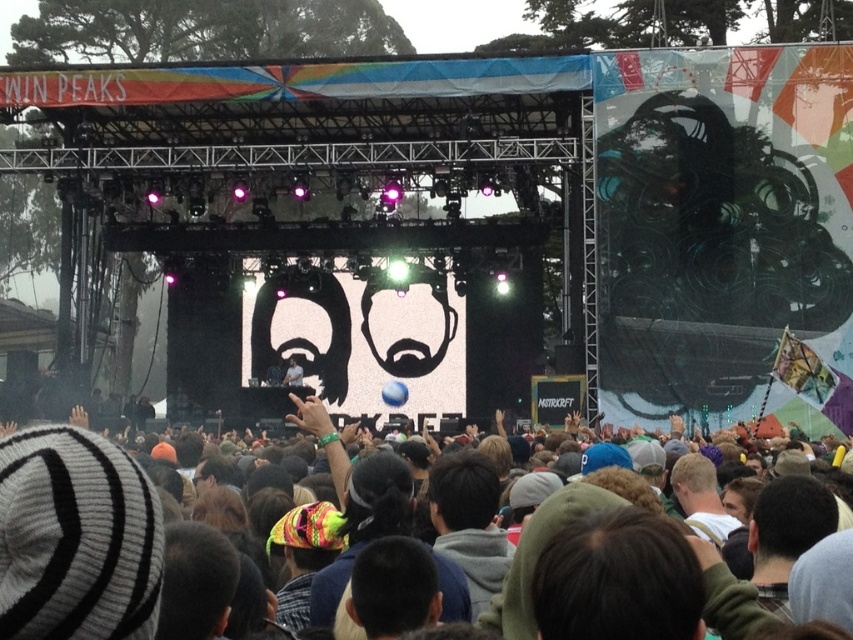
Can you confirm if multicolored fabric crowd at center is positioned above matte yellow sunglasses at center?

Indeed, multicolored fabric crowd at center is positioned over matte yellow sunglasses at center.

Between point (630, 500) and point (204, 474), which one is positioned in front?

Point (630, 500)

Image resolution: width=853 pixels, height=640 pixels. I want to click on multicolored fabric crowd at center, so click(x=310, y=416).

The width and height of the screenshot is (853, 640). What do you see at coordinates (408, 337) in the screenshot?
I see `black matte face at center` at bounding box center [408, 337].

Based on the photo, between black matte face at center and multicolored fabric crowd at center, which one appears on the right side from the viewer's perspective?

From the viewer's perspective, black matte face at center appears more on the right side.

This screenshot has width=853, height=640. Find the location of `black matte face at center`. black matte face at center is located at coordinates (408, 337).

In the scene shown: Is black matte face at center closer to camera compared to smooth skin face at upper center?

No, black matte face at center is behind smooth skin face at upper center.

Is black matte face at center to the right of smooth skin face at upper center from the viewer's perspective?

In fact, black matte face at center is to the left of smooth skin face at upper center.

Does point (373, 344) lie behind point (724, 490)?

Yes, it is.

You are a GUI agent. You are given a task and a screenshot of the screen. Output one action in this format:
    pyautogui.click(x=<x>, y=<y>)
    Task: Click on the black matte face at center
    The image size is (853, 640).
    Given the screenshot: What is the action you would take?
    pyautogui.click(x=408, y=337)